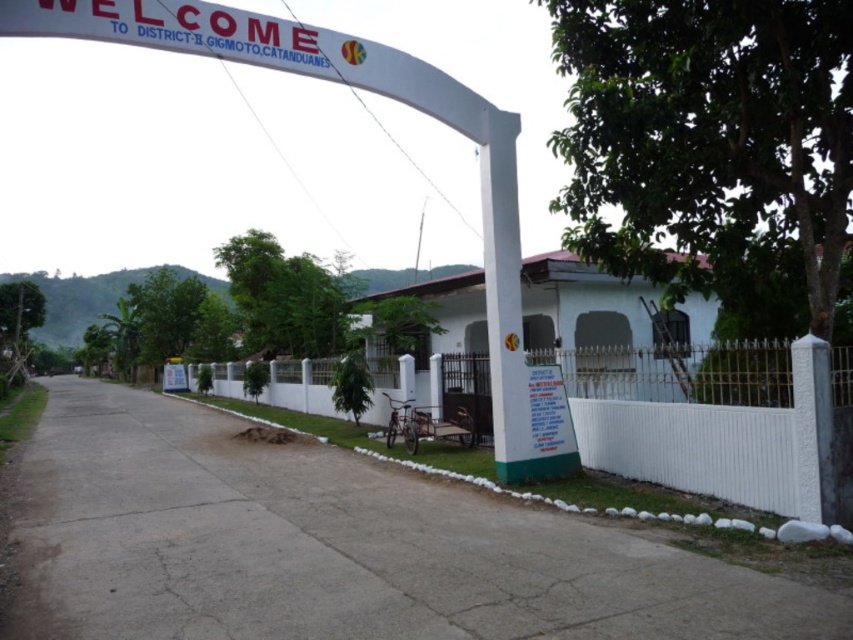
Between white painted metal fence at center and white matte building at center, which one is positioned lower?

white painted metal fence at center

Which is in front, point (221, 372) or point (540, 272)?

Positioned in front is point (540, 272).

Find the location of a particular element. The width and height of the screenshot is (853, 640). white painted metal fence at center is located at coordinates (729, 440).